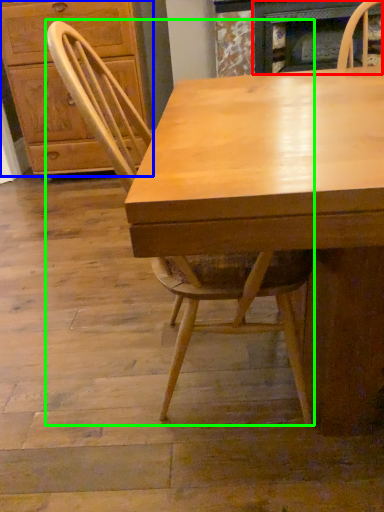
Question: Based on their relative distances, which object is farther from fireplace (highlighted by a red box)? Choose from cabinetry (highlighted by a blue box) and chair (highlighted by a green box).

Choices:
 (A) cabinetry
 (B) chair

Answer: (B)